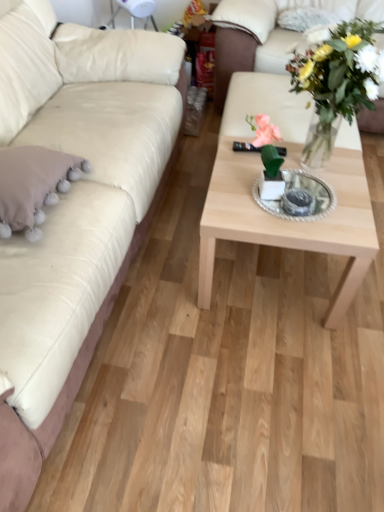
Identify the location of vacant region below natural wood coffee table at center (from a real-world perspective). (274, 272).